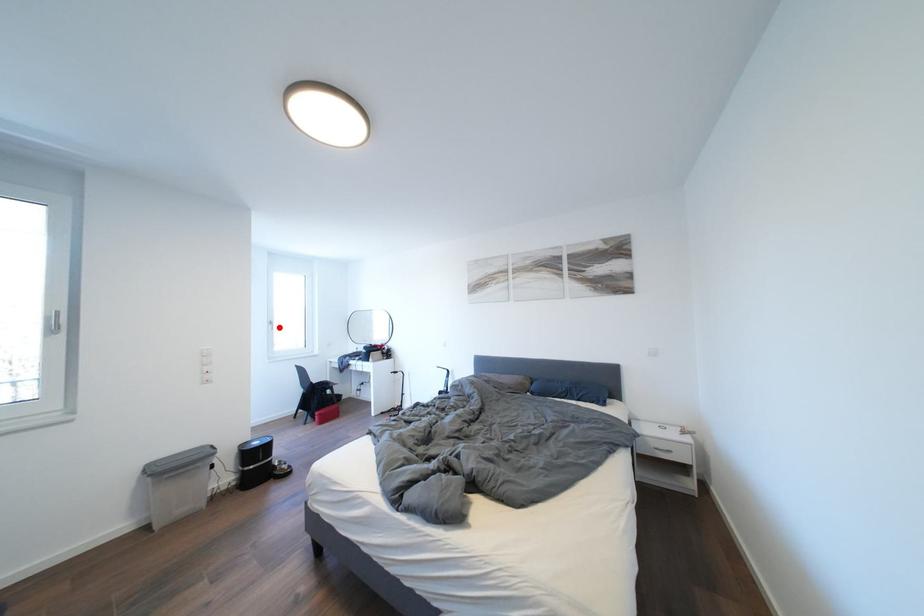
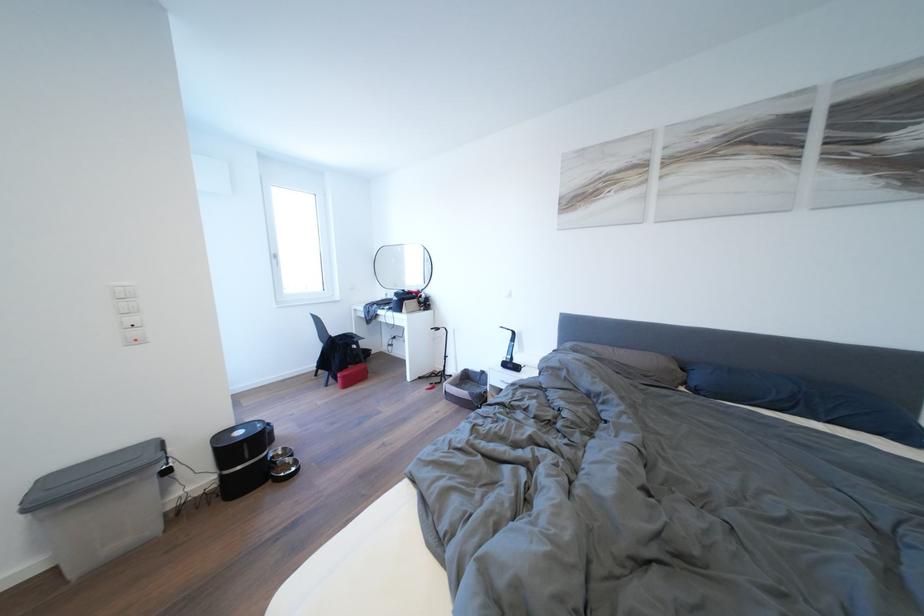
Question: I am providing you with two images of the same scene from different viewpoints. In image1, a red point is highlighted. Considering the same 3D point in image2, which of the following is correct?

Choices:
 (A) It is closer
 (B) It is farther

Answer: (A)